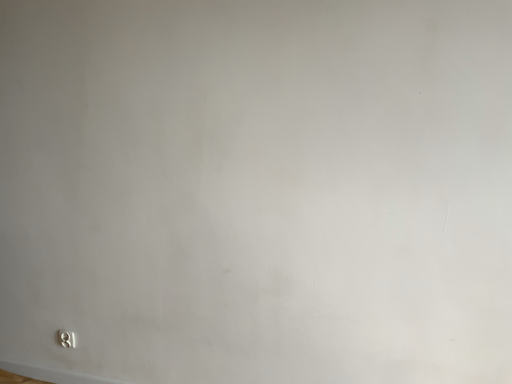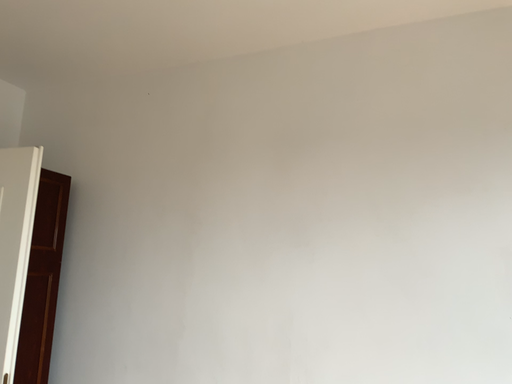
Question: Which way did the camera rotate in the video?

Choices:
 (A) rotated right
 (B) rotated left

Answer: (B)